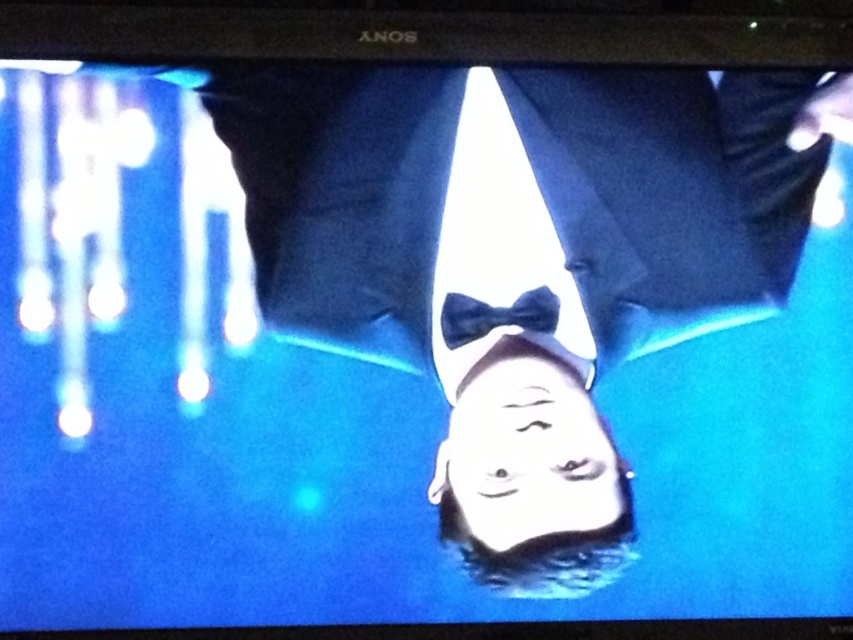
Question: Is smooth black bow tie at center bigger than velvet blue bow tie at center?

Choices:
 (A) no
 (B) yes

Answer: (B)

Question: Which point is farther to the camera?

Choices:
 (A) smooth black bow tie at center
 (B) velvet blue bow tie at center

Answer: (B)

Question: Which of the following is the closest to the observer?

Choices:
 (A) (660, 212)
 (B) (476, 316)

Answer: (A)

Question: Is smooth black bow tie at center above velvet blue bow tie at center?

Choices:
 (A) no
 (B) yes

Answer: (B)

Question: Does smooth black bow tie at center come behind velvet blue bow tie at center?

Choices:
 (A) yes
 (B) no

Answer: (B)